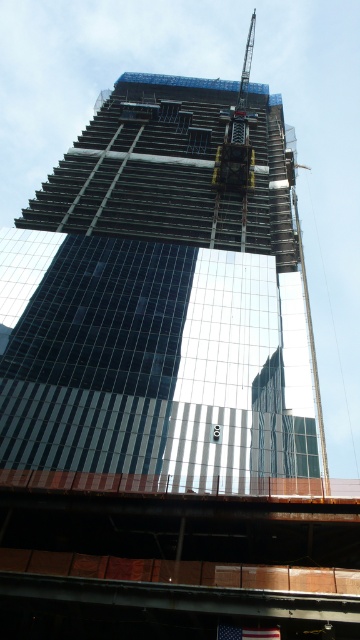
You are a construction worker standing at the base of the glassy reflective skyscraper at center. You need to reach the metallic gray crane at upper center. Which direction should you move to get closer to the crane?

You should move upwards because the metallic gray crane at upper center is further away from you compared to the glassy reflective skyscraper at center, which is closer. To reach the crane, you need to ascend the building or scaffolding towards the upper sections.